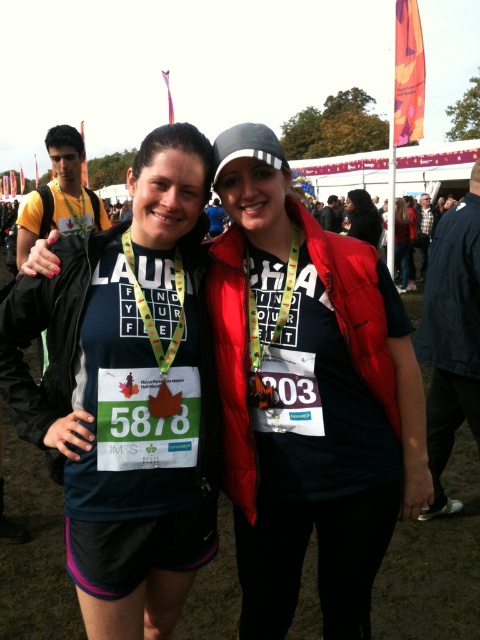
Is matte black jacket at center behind dark gray fabric jacket at center?

No, it is not.

Is point (409, 241) positioned in front of point (335, 205)?

That is True.

Identify the location of matte black jacket at center. (404, 241).

At what (x,y) coordinates should I click in order to perform the action: click on matte black jacket at center. Please return your answer as a coordinate pair (x, y). The image size is (480, 640). Looking at the image, I should click on (404, 241).

In the scene shown: Which of these two, matte black t-shirt at center or dark blue fabric jacket at lower right, stands taller?

With more height is dark blue fabric jacket at lower right.

What do you see at coordinates (128, 394) in the screenshot?
I see `matte black t-shirt at center` at bounding box center [128, 394].

Where is `matte black t-shirt at center`? Image resolution: width=480 pixels, height=640 pixels. matte black t-shirt at center is located at coordinates (128, 394).

Can you confirm if matte black vest at center is taller than dark gray fabric jacket at center?

Yes.

Can you confirm if matte black vest at center is shorter than dark gray fabric jacket at center?

In fact, matte black vest at center may be taller than dark gray fabric jacket at center.

The height and width of the screenshot is (640, 480). What do you see at coordinates (311, 403) in the screenshot?
I see `matte black vest at center` at bounding box center [311, 403].

Find the location of a particular element. The image size is (480, 640). matte black vest at center is located at coordinates (311, 403).